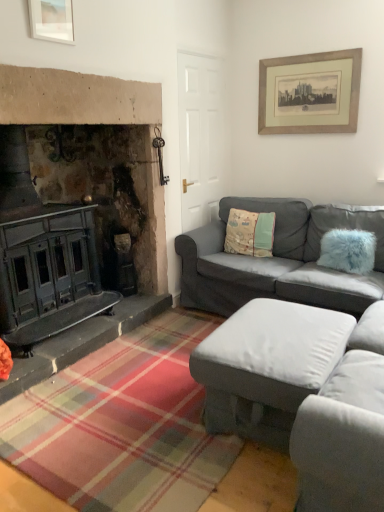
Question: Do you think fuzzy blue pillow at right, which is the 2th pillow in left-to-right order, is within matte white picture frame at upper left, which is counted as the 2th picture frame, starting from the back, or outside of it?

Choices:
 (A) outside
 (B) inside

Answer: (A)

Question: From the image's perspective, is fuzzy blue pillow at right, the 1th pillow when ordered from front to back, located above or below matte white picture frame at upper left, which appears as the 1th picture frame when viewed from the front?

Choices:
 (A) below
 (B) above

Answer: (A)

Question: Estimate the real-world distances between objects in this image. Which object is closer to the gray fabric couch at right, placed as the 1th studio couch when sorted from back to front?

Choices:
 (A) matte gray ottoman at center, acting as the first studio couch starting from the front
 (B) fuzzy blue pillow at right, positioned as the 1th pillow in right-to-left order
 (C) matte white picture frame at upper left, the 1th picture frame from the left
 (D) beige wooden picture frame at upper right, the second picture frame in the left-to-right sequence
 (E) fluffy fabric pillow at center, placed as the 2th pillow when sorted from front to back

Answer: (E)

Question: Which of these objects is positioned farthest from the matte white picture frame at upper left, the 1th picture frame from the left?

Choices:
 (A) gray fabric couch at right, placed as the 1th studio couch when sorted from back to front
 (B) fluffy fabric pillow at center, arranged as the 2th pillow when viewed from the right
 (C) matte gray ottoman at center, which is the second studio couch from back to front
 (D) beige wooden picture frame at upper right, marked as the 2th picture frame in a front-to-back arrangement
 (E) fuzzy blue pillow at right, positioned as the 1th pillow in right-to-left order

Answer: (E)